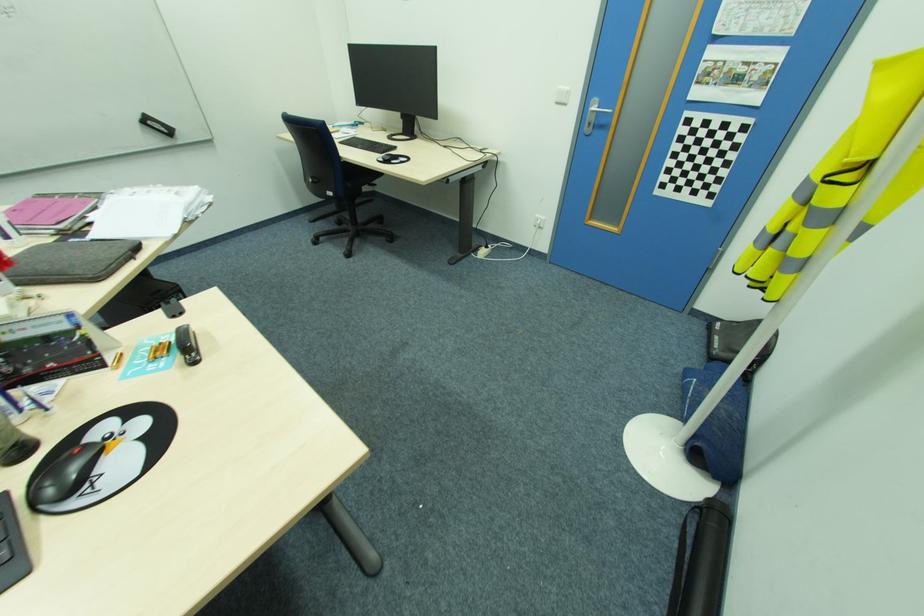
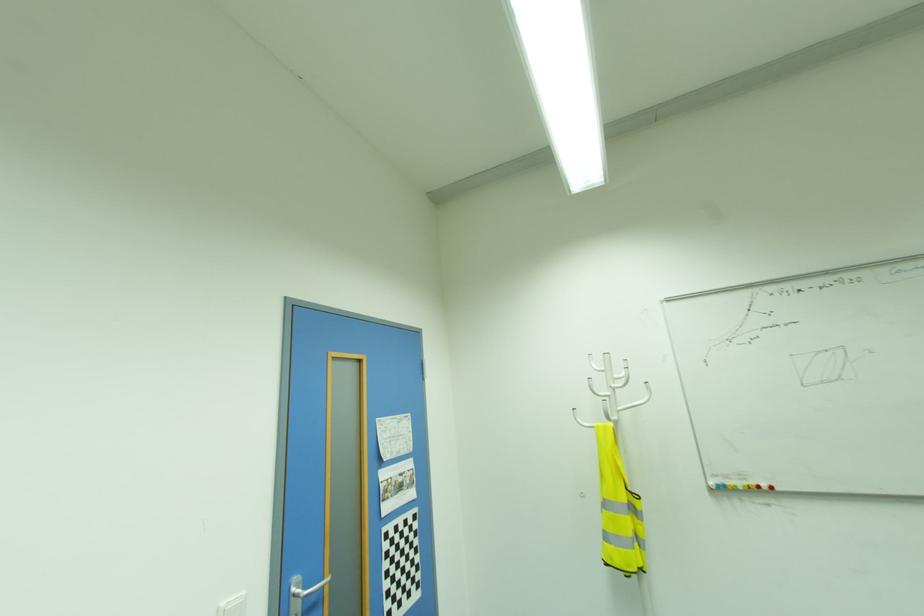
Locate, in the second image, the point that corresponds to the point at 562,87 in the first image.

(226, 602)